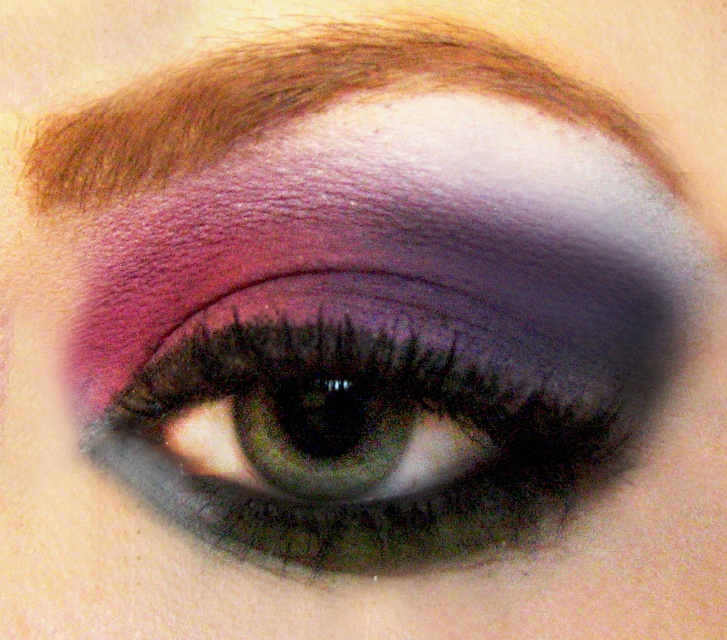
Question: Which of the following is the farthest from the observer?

Choices:
 (A) (369, 328)
 (B) (278, 72)

Answer: (A)

Question: Does shimmering pink eyeshadow at center appear under brown hair at upper center?

Choices:
 (A) no
 (B) yes

Answer: (B)

Question: Is shimmering pink eyeshadow at center positioned in front of brown hair at upper center?

Choices:
 (A) no
 (B) yes

Answer: (A)

Question: Does shimmering pink eyeshadow at center come in front of brown hair at upper center?

Choices:
 (A) no
 (B) yes

Answer: (A)